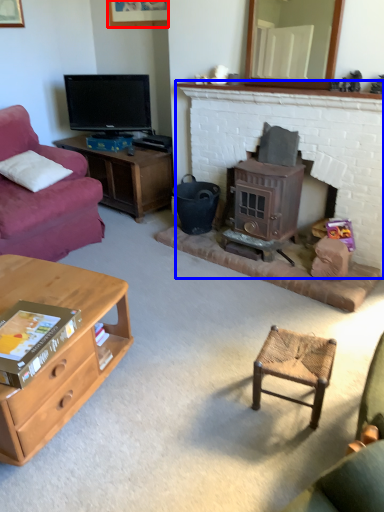
Question: Among these objects, which one is farthest to the camera, picture frame (highlighted by a red box) or fireplace (highlighted by a blue box)?

Choices:
 (A) picture frame
 (B) fireplace

Answer: (A)